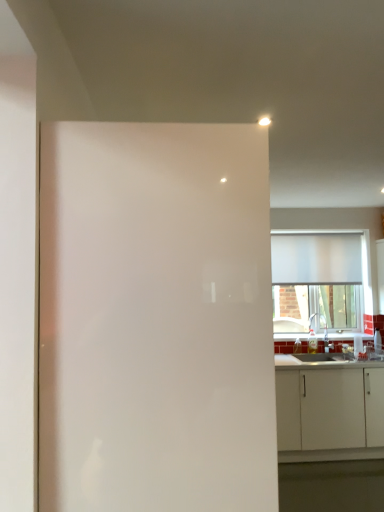
What do you see at coordinates (155, 319) in the screenshot?
I see `white glossy screen door at center` at bounding box center [155, 319].

You are a GUI agent. You are given a task and a screenshot of the screen. Output one action in this format:
    pyautogui.click(x=<x>, y=<y>)
    Task: Click on the white glossy screen door at center
    This screenshot has width=384, height=512.
    Given the screenshot: What is the action you would take?
    pyautogui.click(x=155, y=319)

This screenshot has height=512, width=384. What do you see at coordinates (330, 414) in the screenshot?
I see `white matte cabinet at lower right` at bounding box center [330, 414].

In order to click on white glossy screen door at center in this screenshot , I will do `click(155, 319)`.

From a real-world perspective, which is physically above, white matte cabinet at lower right or white glossy screen door at center?

white glossy screen door at center, from a real-world perspective.

From their relative heights in the image, would you say white matte cabinet at lower right is taller or shorter than white glossy screen door at center?

Considering their sizes, white matte cabinet at lower right has less height than white glossy screen door at center.

Is white glossy screen door at center at the back of white matte cabinet at lower right?

white matte cabinet at lower right does not have its back to white glossy screen door at center.

What's the angular difference between white glossy countertop at lower right and white matte cabinet at lower right's facing directions?

The angle between the facing direction of white glossy countertop at lower right and the facing direction of white matte cabinet at lower right is 1.22 degrees.

Based on their sizes in the image, would you say white glossy countertop at lower right is bigger or smaller than white matte cabinet at lower right?

In the image, white glossy countertop at lower right appears to be smaller than white matte cabinet at lower right.

Is white glossy countertop at lower right not within white matte cabinet at lower right?

No, white glossy countertop at lower right is inside white matte cabinet at lower right's boundary.

Measure the distance between white glossy countertop at lower right and white matte cabinet at lower right.

white glossy countertop at lower right and white matte cabinet at lower right are 14.07 inches apart.

Which is in front, white glossy screen door at center or white glossy countertop at lower right?

white glossy screen door at center.

Considering the sizes of objects white glossy screen door at center and white glossy countertop at lower right in the image provided, who is thinner, white glossy screen door at center or white glossy countertop at lower right?

With smaller width is white glossy countertop at lower right.

Which of these two, white glossy screen door at center or white glossy countertop at lower right, is bigger?

With larger size is white glossy screen door at center.

From a real-world perspective, which is physically below, white glossy countertop at lower right or white glossy screen door at center?

white glossy countertop at lower right.

Considering the positions of point (315, 360) and point (46, 158), is point (315, 360) closer or farther from the camera than point (46, 158)?

Point (315, 360) appears to be farther away from the viewer than point (46, 158).

From the image's perspective, which object appears higher, white glossy countertop at lower right or white glossy screen door at center?

white glossy screen door at center is shown above in the image.

Does white glossy countertop at lower right have a lesser width compared to white matte window at upper right?

No, white glossy countertop at lower right is not thinner than white matte window at upper right.

Can you confirm if white glossy countertop at lower right is shorter than white matte window at upper right?

Indeed, white glossy countertop at lower right has a lesser height compared to white matte window at upper right.

Is point (287, 359) closer to camera compared to point (358, 258)?

Yes, point (287, 359) is in front of point (358, 258).

From a real-world perspective, does white glossy countertop at lower right stand above white matte window at upper right?

No, from a real-world perspective, white glossy countertop at lower right is not over white matte window at upper right

Is white matte cabinet at lower right located within white glossy screen door at center?

No, white matte cabinet at lower right is not a part of white glossy screen door at center.

Which is more to the left, white glossy screen door at center or white matte cabinet at lower right?

white glossy screen door at center.

From the image's perspective, is white glossy screen door at center under white matte cabinet at lower right?

No.

Is white glossy screen door at center positioned in front of white matte cabinet at lower right?

Yes, it is.

You are a GUI agent. You are given a task and a screenshot of the screen. Output one action in this format:
    pyautogui.click(x=<x>, y=<y>)
    Task: Click on the cabinetry in front of the white matte window at upper right
    The image size is (384, 512).
    Given the screenshot: What is the action you would take?
    pyautogui.click(x=330, y=414)

Considering the sizes of objects white matte cabinet at lower right and white matte window at upper right in the image provided, who is bigger, white matte cabinet at lower right or white matte window at upper right?

With larger size is white matte cabinet at lower right.

Is white matte cabinet at lower right looking in the opposite direction of white matte window at upper right?

white matte cabinet at lower right does not have its back to white matte window at upper right.

Is white matte cabinet at lower right in contact with white matte window at upper right?

white matte cabinet at lower right and white matte window at upper right are not in contact.

This screenshot has width=384, height=512. There is a white matte cabinet at lower right. In order to click on screen door above it (from a real-world perspective) in this screenshot , I will do `click(155, 319)`.

Locate an element on the screen. Image resolution: width=384 pixels, height=512 pixels. countertop lying above the white matte cabinet at lower right (from the image's perspective) is located at coordinates (324, 361).

Considering their positions, is white matte window at upper right positioned closer to white matte cabinet at lower right than white glossy countertop at lower right?

The object closer to white matte cabinet at lower right is white glossy countertop at lower right.

Considering their positions, is white glossy screen door at center positioned closer to white matte window at upper right than white matte cabinet at lower right?

Based on the image, white matte cabinet at lower right appears to be nearer to white matte window at upper right.

Consider the image. Considering their positions, is white glossy countertop at lower right positioned closer to white matte window at upper right than white glossy screen door at center?

The object closer to white matte window at upper right is white glossy countertop at lower right.

Estimate the real-world distances between objects in this image. Which object is closer to white glossy screen door at center, white matte cabinet at lower right or white matte window at upper right?

Among the two, white matte cabinet at lower right is located nearer to white glossy screen door at center.

From the picture: From the image, which object appears to be farther from white glossy countertop at lower right, white matte cabinet at lower right or white glossy screen door at center?

white glossy screen door at center.

Based on their spatial positions, is white matte cabinet at lower right or white glossy countertop at lower right closer to white matte window at upper right?

white glossy countertop at lower right.

Estimate the real-world distances between objects in this image. Which object is closer to white glossy screen door at center, white matte window at upper right or white matte cabinet at lower right?

Among the two, white matte cabinet at lower right is located nearer to white glossy screen door at center.

When comparing their distances from white matte cabinet at lower right, does white glossy screen door at center or white matte window at upper right seem further?

The object further to white matte cabinet at lower right is white glossy screen door at center.

The height and width of the screenshot is (512, 384). What are the coordinates of `countertop between white glossy screen door at center and white matte window at upper right along the z-axis` in the screenshot? It's located at (324, 361).

At what (x,y) coordinates should I click in order to perform the action: click on cabinetry located between white glossy screen door at center and white matte window at upper right in the depth direction. Please return your answer as a coordinate pair (x, y). Looking at the image, I should click on (330, 414).

You are a GUI agent. You are given a task and a screenshot of the screen. Output one action in this format:
    pyautogui.click(x=<x>, y=<y>)
    Task: Click on the countertop that lies between white matte window at upper right and white matte cabinet at lower right from top to bottom
    Image resolution: width=384 pixels, height=512 pixels.
    Given the screenshot: What is the action you would take?
    pyautogui.click(x=324, y=361)

Locate an element on the screen. cabinetry positioned between white glossy screen door at center and white glossy countertop at lower right from near to far is located at coordinates (330, 414).